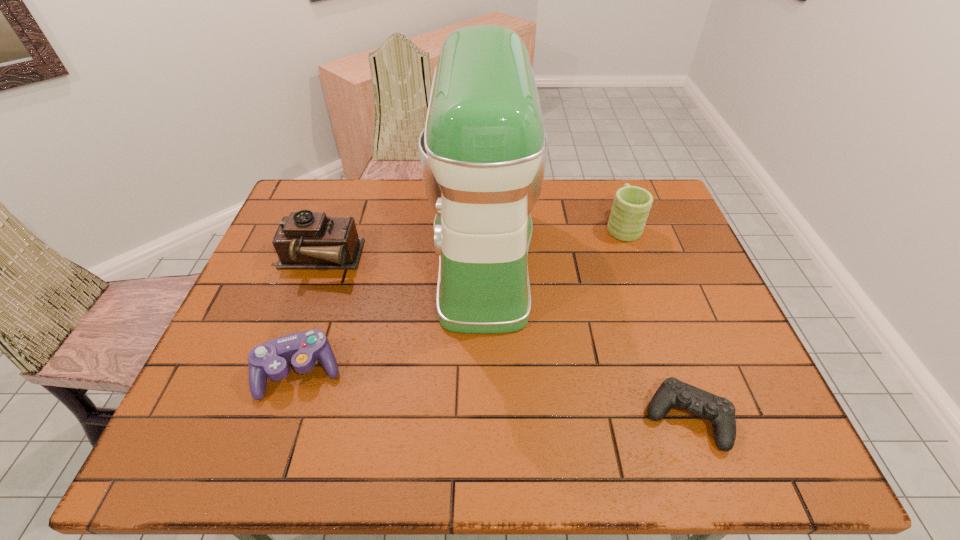
At what (x,y) coordinates should I click in order to perform the action: click on vacant space that satisfies the following two spatial constraints: 1. on the controls of the mixer; 2. on the back side of the shortest object. Please return your answer as a coordinate pair (x, y). Looking at the image, I should click on (484, 418).

You are a GUI agent. You are given a task and a screenshot of the screen. Output one action in this format:
    pyautogui.click(x=<x>, y=<y>)
    Task: Click on the vacant space that satisfies the following two spatial constraints: 1. on the back side of the shorter control; 2. on the controls of the third object from right to left
    Image resolution: width=960 pixels, height=540 pixels.
    Given the screenshot: What is the action you would take?
    pyautogui.click(x=631, y=257)

Locate an element on the screen. The image size is (960, 540). vacant point that satisfies the following two spatial constraints: 1. on the horn of the phonograph_record; 2. on the back side of the shortest object is located at coordinates (258, 418).

At what (x,y) coordinates should I click in order to perform the action: click on free space that satisfies the following two spatial constraints: 1. on the controls of the shorter control; 2. on the left side of the mixer. Please return your answer as a coordinate pair (x, y). The height and width of the screenshot is (540, 960). Looking at the image, I should click on (484, 418).

The height and width of the screenshot is (540, 960). I want to click on free space that satisfies the following two spatial constraints: 1. on the horn of the phonograph_record; 2. on the left side of the shortest object, so (x=258, y=418).